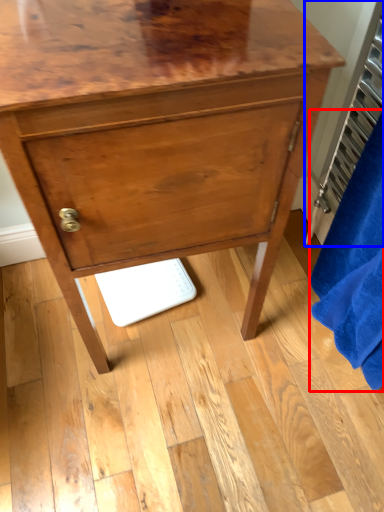
Question: Among these objects, which one is farthest to the camera, bath towel (highlighted by a red box) or radiator (highlighted by a blue box)?

Choices:
 (A) bath towel
 (B) radiator

Answer: (B)